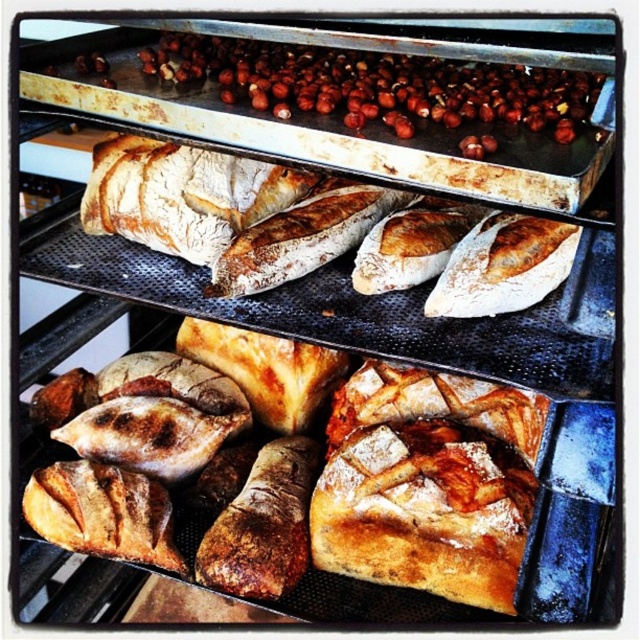
You are a baker who just took out the metal trays from the oven. You see the point at coordinate (320, 228). What type of bread is located at that point?

The point at coordinate (320, 228) marks a slightly golden crusty baguette at center.

You are a baker who wants to place a new tray of cinnamon rolls between the slightly golden crusty baguette at center and the brown matte nuts at upper center. Based on their positions, which side of the baguette should you place the new tray on?

The slightly golden crusty baguette at center is positioned on the right side of brown matte nuts at upper center, so to place the new tray between them, you should put it on the left side of the baguette.

You are a baker who needs to place a 15 cm wide baking tool between the slightly golden crusty baguette at center and the brown matte nuts at upper center. Can you fit it there?

The slightly golden crusty baguette at center is narrower than the brown matte nuts at upper center. However, the description only provides information about their widths relative to each other, not the actual space between them. Without knowing the distance between the two objects, it is impossible to determine if the 15 cm wide baking tool can fit.